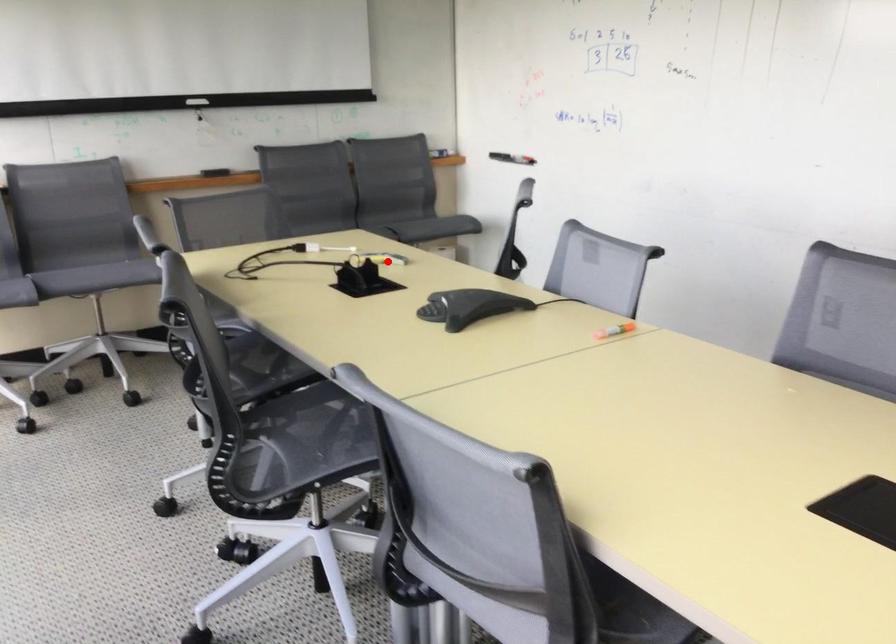
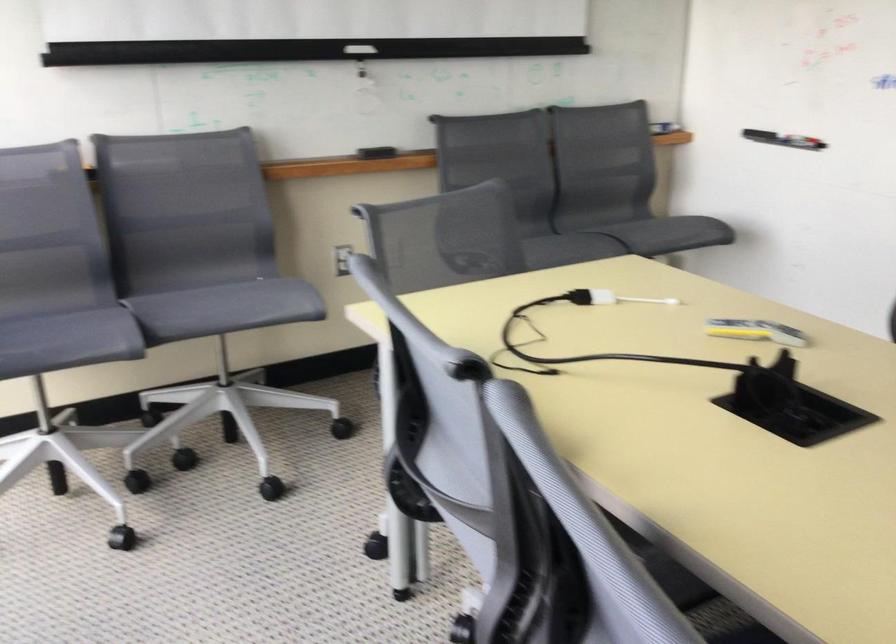
Where in the second image is the point corresponding to the highlighted location from the first image?

(755, 330)